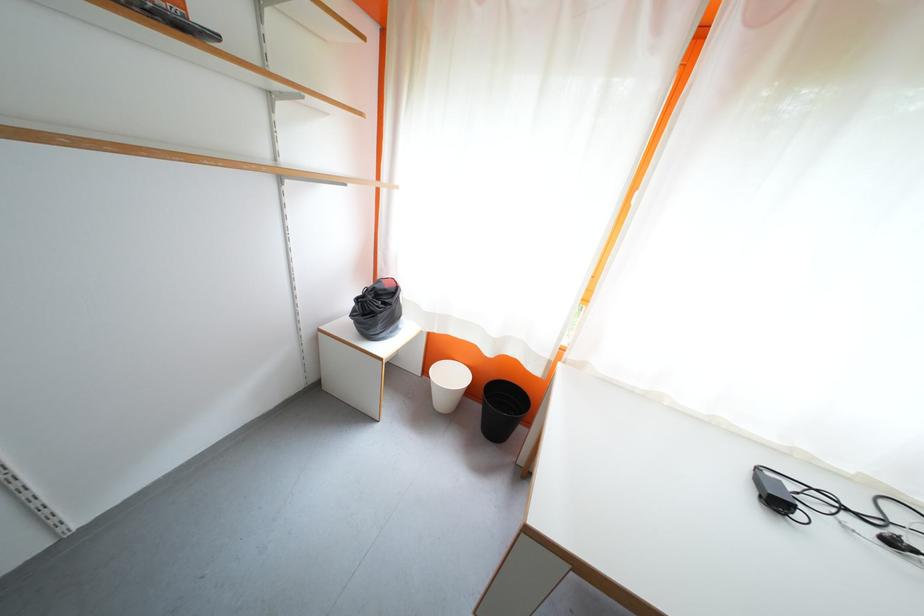
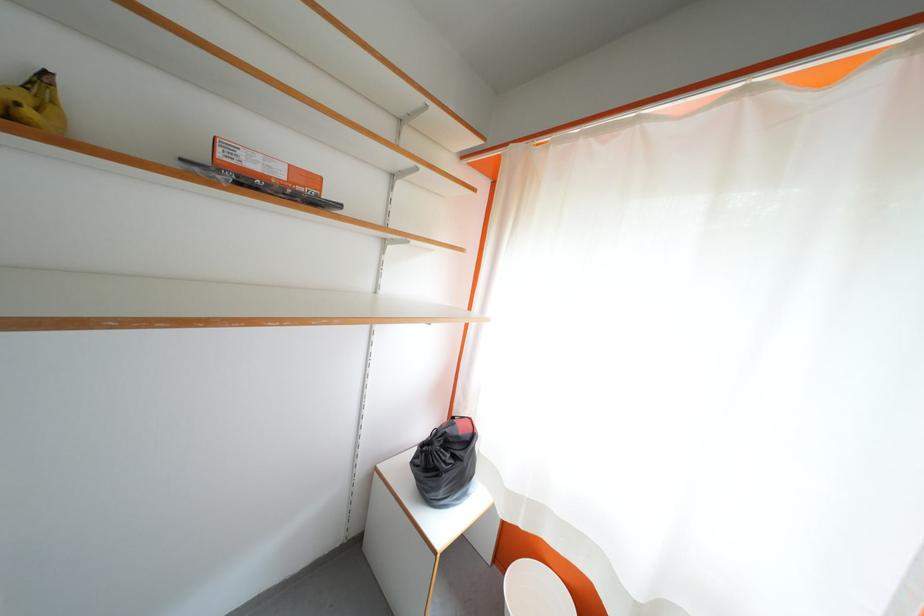
Question: The images are taken continuously from a first-person perspective. In which direction are you moving?

Choices:
 (A) Left
 (B) Right
 (C) Forward
 (D) Backward

Answer: (C)